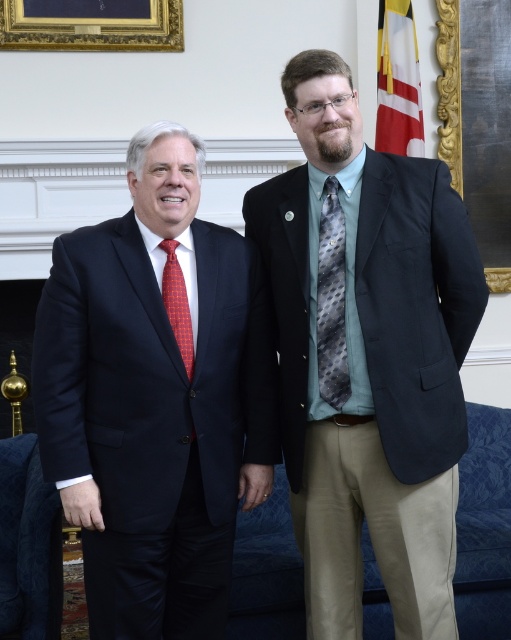
Based on the photo, you are a photographer setting up for a portrait session. You have a camera with a focal length of 50mm and want to ensure the matte black blazer at center is in sharp focus. If the recommended focus distance for this setup is between 6 to 8 feet, will the current distance of 7.34 feet work?

Yes, the current distance of 7.34 feet falls within the recommended focus distance range of 6 to 8 feet, so the matte black blazer at center will be in sharp focus.

You are a photographer setting up for a group photo. You need to place a small prop at the exact coordinates given in the objects. The prop must be placed on the matte black blazer at center. Is the point at coordinates point (367, 355) suitable for placing the prop?

Yes, the point at coordinates point (367, 355) is suitable because it directly corresponds to the matte black blazer at center, ensuring the prop will be placed on it.